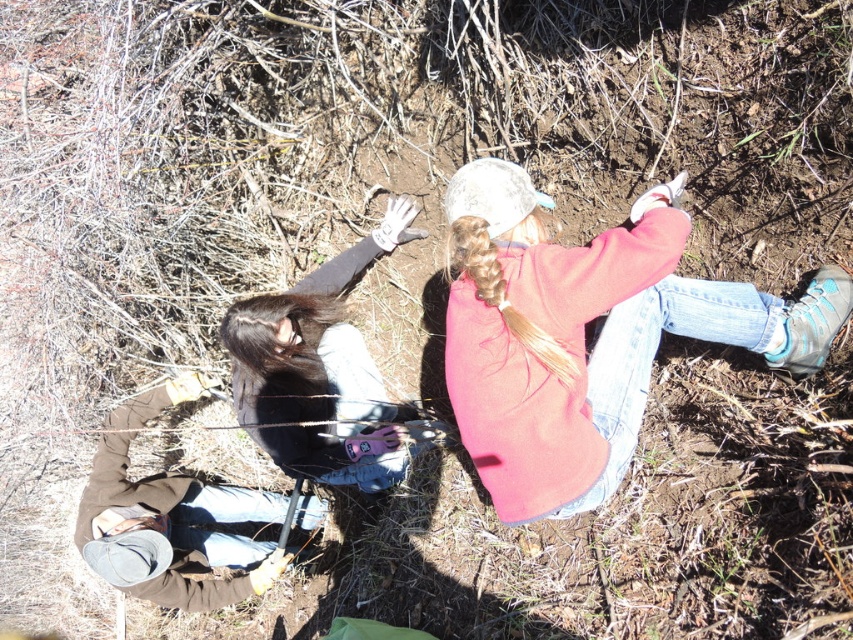
Is pink fleece jacket at center smaller than brown suede jacket at lower left?

No, pink fleece jacket at center is not smaller than brown suede jacket at lower left.

Is pink fleece jacket at center to the right of brown suede jacket at lower left from the viewer's perspective?

Indeed, pink fleece jacket at center is positioned on the right side of brown suede jacket at lower left.

Does point (506, 298) come behind point (97, 490)?

No, (506, 298) is in front of (97, 490).

The width and height of the screenshot is (853, 640). I want to click on pink fleece jacket at center, so click(x=583, y=336).

Is dark brown leather jacket at lower left to the left of brown suede jacket at lower left from the viewer's perspective?

No, dark brown leather jacket at lower left is not to the left of brown suede jacket at lower left.

Does dark brown leather jacket at lower left lie behind brown suede jacket at lower left?

No.

Locate an element on the screen. dark brown leather jacket at lower left is located at coordinates (318, 371).

Does pink fleece jacket at center appear over dark brown leather jacket at lower left?

Correct, pink fleece jacket at center is located above dark brown leather jacket at lower left.

Is point (817, 304) behind point (334, 474)?

No, it is not.

This screenshot has height=640, width=853. Identify the location of pink fleece jacket at center. (583, 336).

I want to click on pink fleece jacket at center, so click(x=583, y=336).